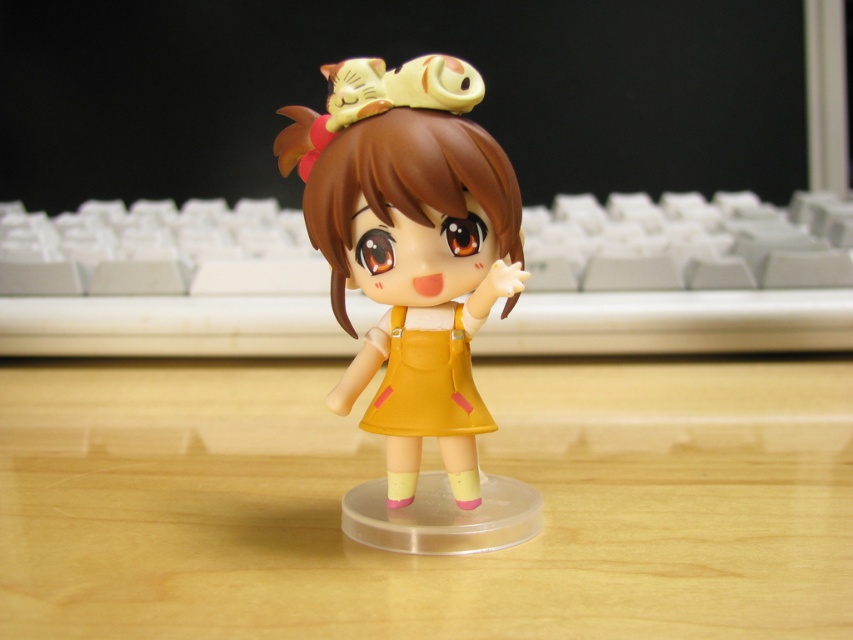
Question: Which of the following is the closest to the observer?

Choices:
 (A) matte yellow dress at center
 (B) wooden table at center
 (C) white plastic keyboard at center
 (D) yellow matte dress at center

Answer: (B)

Question: Can you confirm if matte yellow dress at center is bigger than yellow matte dress at center?

Choices:
 (A) yes
 (B) no

Answer: (A)

Question: Is wooden table at center further to the viewer compared to yellow matte dress at center?

Choices:
 (A) yes
 (B) no

Answer: (B)

Question: Which point is closer to the camera taking this photo?

Choices:
 (A) (155, 620)
 (B) (480, 284)
 (C) (454, 339)

Answer: (A)

Question: Is wooden table at center thinner than yellow matte dress at center?

Choices:
 (A) no
 (B) yes

Answer: (A)

Question: Among these points, which one is nearest to the camera?

Choices:
 (A) pyautogui.click(x=419, y=330)
 (B) pyautogui.click(x=596, y=344)
 (C) pyautogui.click(x=230, y=483)
 (D) pyautogui.click(x=383, y=189)

Answer: (D)